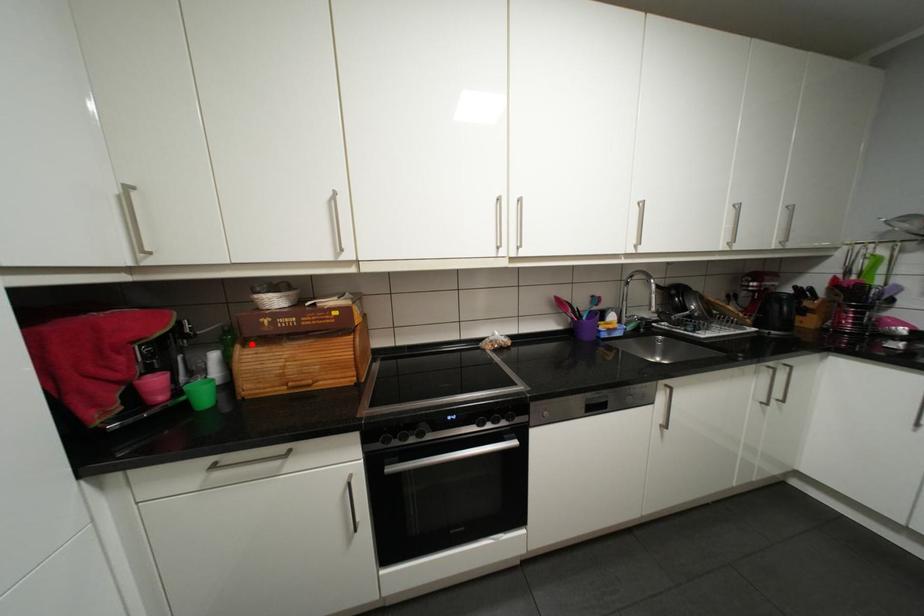
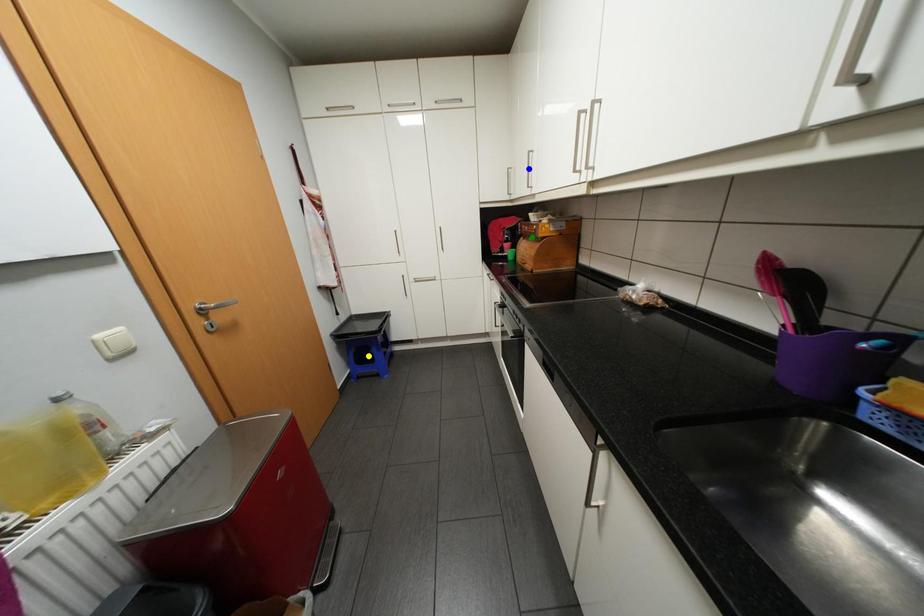
Question: I am providing you with two images of the same scene from different viewpoints. A red point is marked on the first image. You are given multiple points on the second image. Can you choose the point in image 2 that corresponds to the point in image 1?

Choices:
 (A) blue point
 (B) yellow point
 (C) green point

Answer: (C)